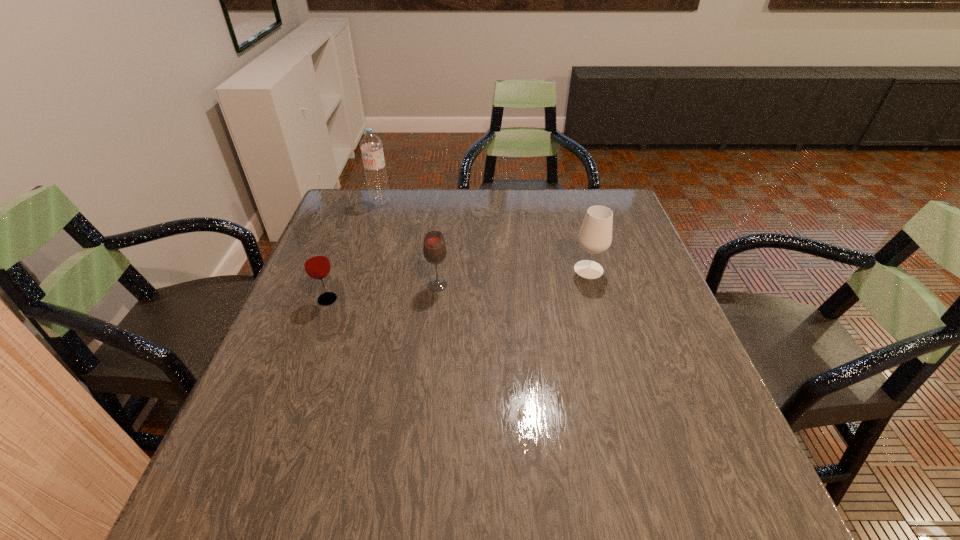
Locate an element on the screen. Image resolution: width=960 pixels, height=540 pixels. water bottle that is at the left edge is located at coordinates (371, 146).

The height and width of the screenshot is (540, 960). I want to click on glass that is at the left edge, so click(316, 263).

Where is `object present at the right edge`? Image resolution: width=960 pixels, height=540 pixels. object present at the right edge is located at coordinates (595, 236).

At what (x,y) coordinates should I click in order to perform the action: click on object that is at the far left corner. Please return your answer as a coordinate pair (x, y). This screenshot has height=540, width=960. Looking at the image, I should click on (371, 146).

You are a GUI agent. You are given a task and a screenshot of the screen. Output one action in this format:
    pyautogui.click(x=<x>, y=<y>)
    Task: Click on the free space at the far edge
    The image size is (960, 540).
    Given the screenshot: What is the action you would take?
    pyautogui.click(x=522, y=228)

This screenshot has width=960, height=540. Find the location of `vacant area at the left edge of the desktop`. vacant area at the left edge of the desktop is located at coordinates (334, 354).

Find the location of a particular element. The image size is (960, 540). vacant space at the right edge of the desktop is located at coordinates (634, 314).

Identify the location of vacant region at the far left corner of the desktop. The width and height of the screenshot is (960, 540). (344, 216).

Find the location of a particular element. free space at the near left corner of the desktop is located at coordinates (272, 485).

Locate an element on the screen. This screenshot has height=540, width=960. vacant area that lies between the leftmost glass and the tallest object is located at coordinates (354, 251).